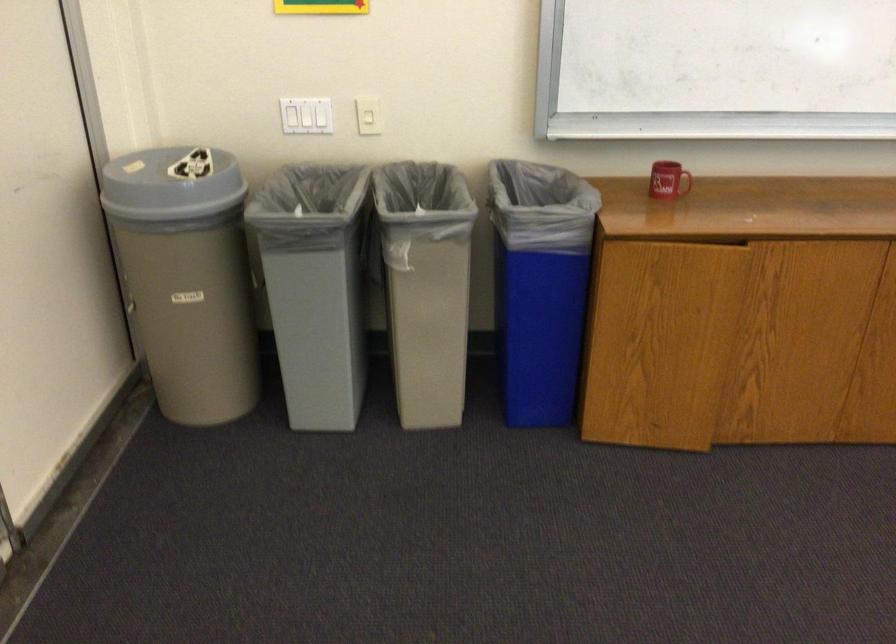
Where is `trash can lid flap`? trash can lid flap is located at coordinates (539, 286).